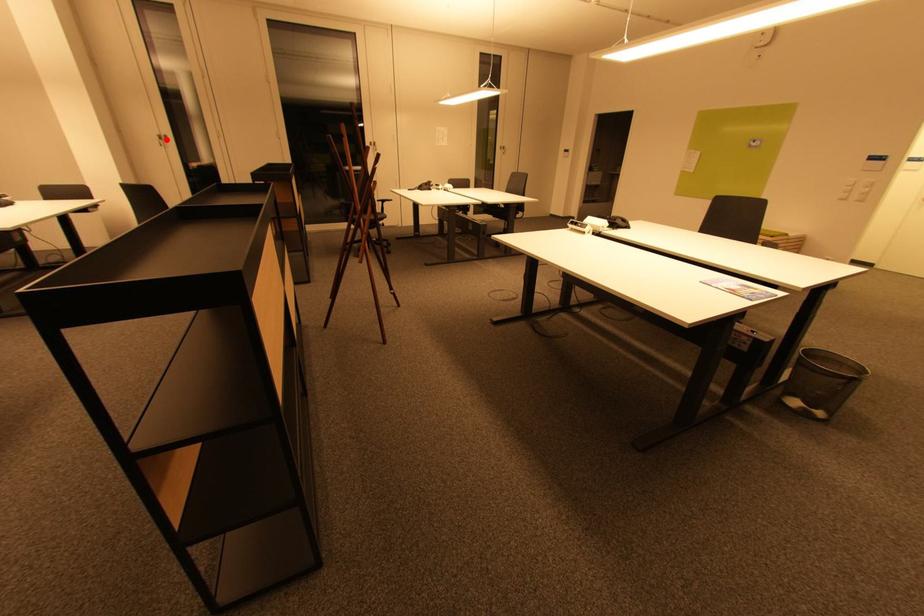
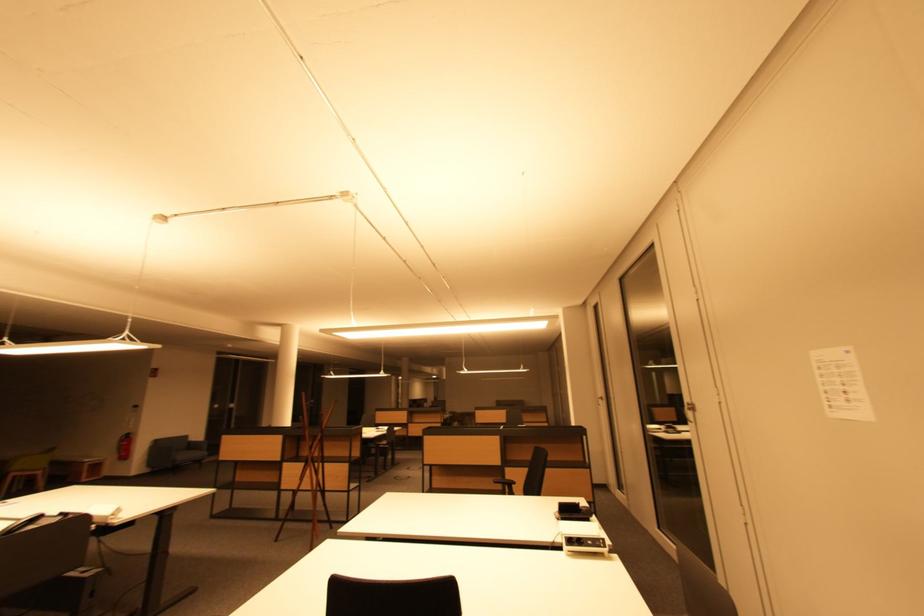
Question: I am providing you with two images of the same scene from different viewpoints. A red point is marked on the first image. Is the red point's position out of view in image 2?

Choices:
 (A) Yes
 (B) No

Answer: (B)